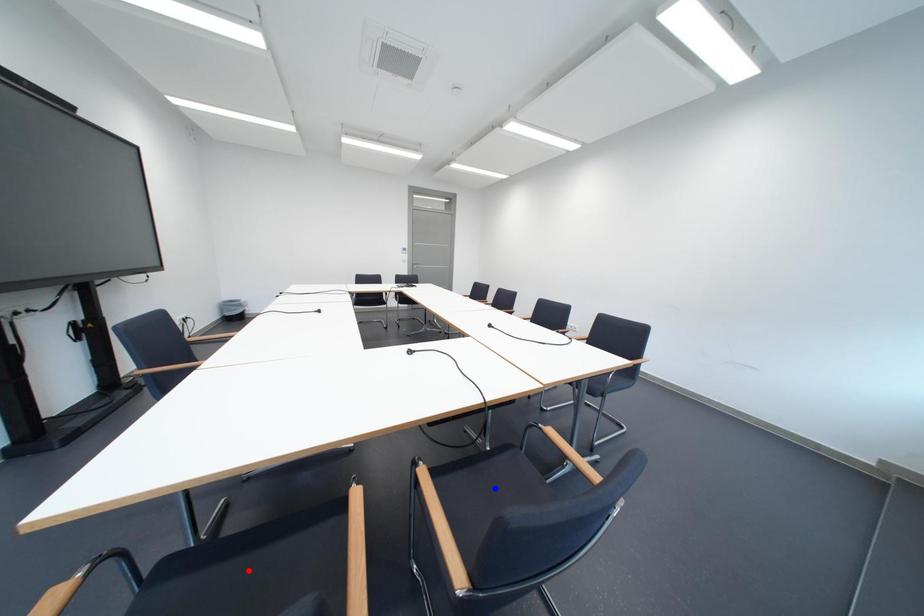
Question: In the image, two points are highlighted. Which point is nearer to the camera? Reply with the corresponding letter.

Choices:
 (A) blue point
 (B) red point

Answer: (B)